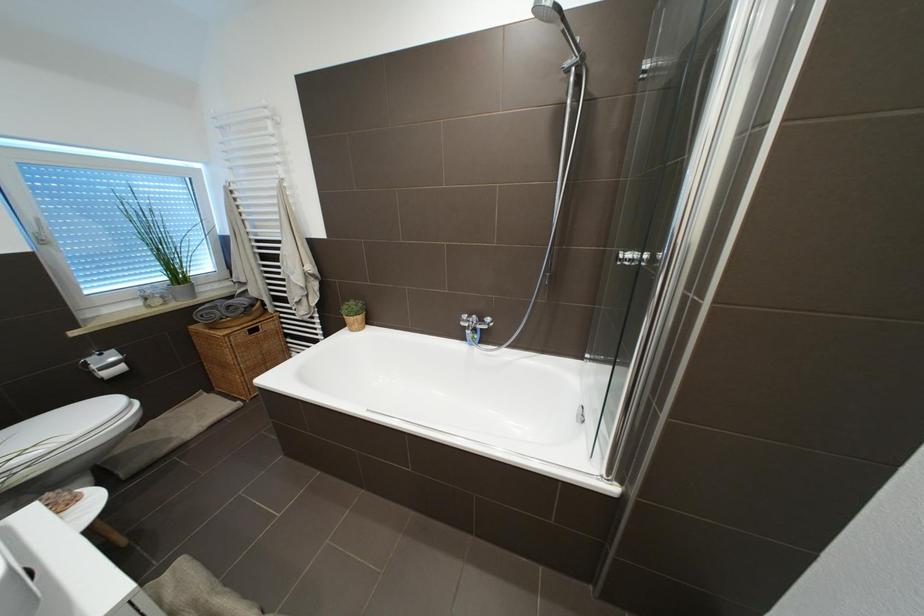
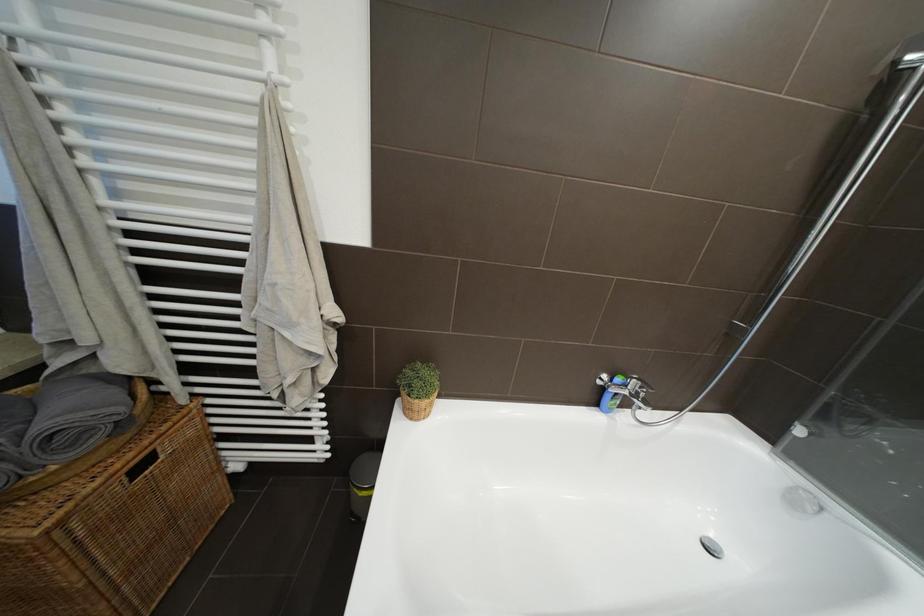
In a continuous first-person perspective shot, in which direction is the camera moving?

The cameraman walked toward left, forward.